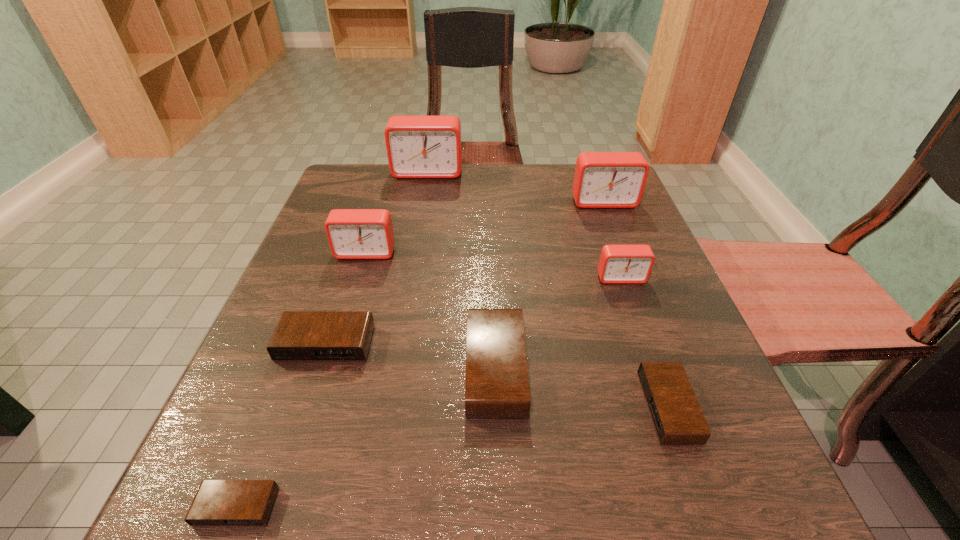
You are a GUI agent. You are given a task and a screenshot of the screen. Output one action in this format:
    pyautogui.click(x=<x>, y=<y>)
    Task: Click on the vacant space that is in between the third shortest object and the fourth shortest object
    The height and width of the screenshot is (540, 960).
    Given the screenshot: What is the action you would take?
    pyautogui.click(x=411, y=356)

Where is `empty space between the rightmost black alarm clock and the second biggest red alarm clock`? empty space between the rightmost black alarm clock and the second biggest red alarm clock is located at coordinates (636, 304).

This screenshot has height=540, width=960. I want to click on free area in between the nearest object and the second smallest red alarm clock, so click(x=301, y=380).

Where is `unoccupied position between the second black alarm clock from right to left and the biggest red alarm clock`? Image resolution: width=960 pixels, height=540 pixels. unoccupied position between the second black alarm clock from right to left and the biggest red alarm clock is located at coordinates pos(462,270).

Where is `free space between the second shortest object and the nearest alarm clock`? Image resolution: width=960 pixels, height=540 pixels. free space between the second shortest object and the nearest alarm clock is located at coordinates (452, 457).

Find the location of a particular element. This screenshot has height=540, width=960. free space between the third farthest object and the second farthest alarm clock is located at coordinates (485, 227).

You are a GUI agent. You are given a task and a screenshot of the screen. Output one action in this format:
    pyautogui.click(x=<x>, y=<y>)
    Task: Click on the object that can be found as the closest to the tallest alarm clock
    
    Given the screenshot: What is the action you would take?
    pyautogui.click(x=352, y=233)

Where is `object identified as the fifth closest to the fourth alarm clock from right to left`? The image size is (960, 540). object identified as the fifth closest to the fourth alarm clock from right to left is located at coordinates (218, 503).

Find the location of a particular element. The height and width of the screenshot is (540, 960). the third closest alarm clock to the tallest alarm clock is located at coordinates (619, 264).

This screenshot has height=540, width=960. Find the location of `alarm clock identified as the second closest to the second tallest alarm clock`. alarm clock identified as the second closest to the second tallest alarm clock is located at coordinates (417, 146).